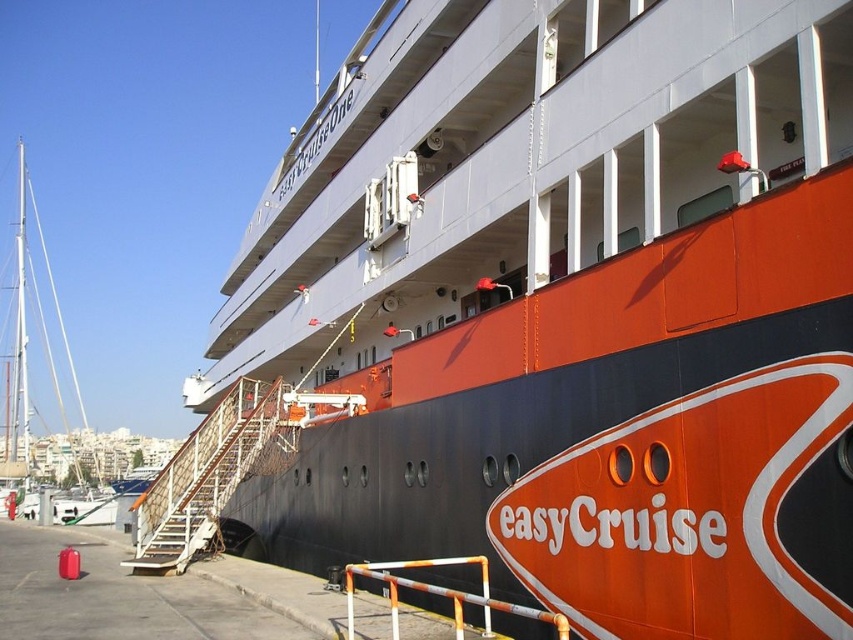
From the picture: Between white glossy sailboat at left and orange/white metal railing at lower center, which one has less height?

orange/white metal railing at lower center is shorter.

Is white glossy sailboat at left smaller than orange/white metal railing at lower center?

No, white glossy sailboat at left is not smaller than orange/white metal railing at lower center.

Is point (22, 148) positioned after point (532, 616)?

Yes.

Locate an element on the screen. white glossy sailboat at left is located at coordinates (26, 333).

Does metallic stair rail at center have a larger size compared to white glossy sailboat at left?

No.

The image size is (853, 640). Identify the location of metallic stair rail at center. coord(202,477).

Can you confirm if metallic stair rail at center is positioned to the right of orange/white metal railing at lower center?

In fact, metallic stair rail at center is to the left of orange/white metal railing at lower center.

Consider the image. Is metallic stair rail at center shorter than orange/white metal railing at lower center?

Incorrect, metallic stair rail at center's height does not fall short of orange/white metal railing at lower center's.

In order to click on metallic stair rail at center in this screenshot , I will do `click(202, 477)`.